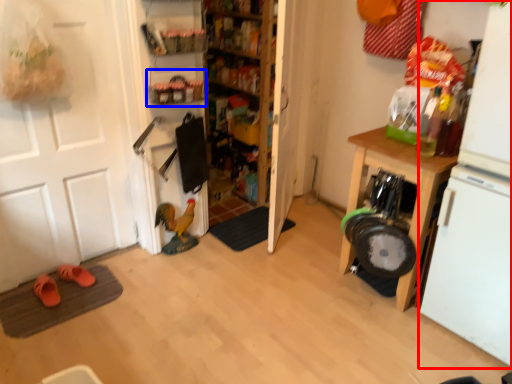
Question: Which of the following is the closest to the observer, appliance (highlighted by a red box) or shelf (highlighted by a blue box)?

Choices:
 (A) appliance
 (B) shelf

Answer: (A)